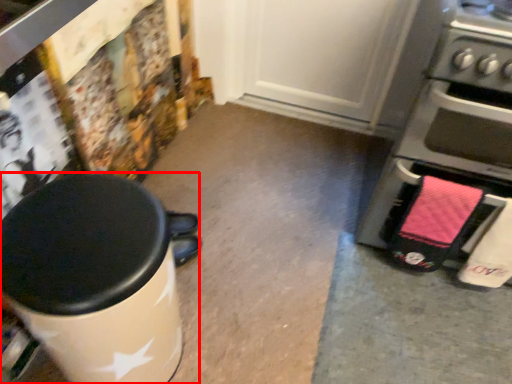
Question: From the image, what is the correct spatial relationship of waste container (annotated by the red box) in relation to home appliance?

Choices:
 (A) right
 (B) left

Answer: (B)